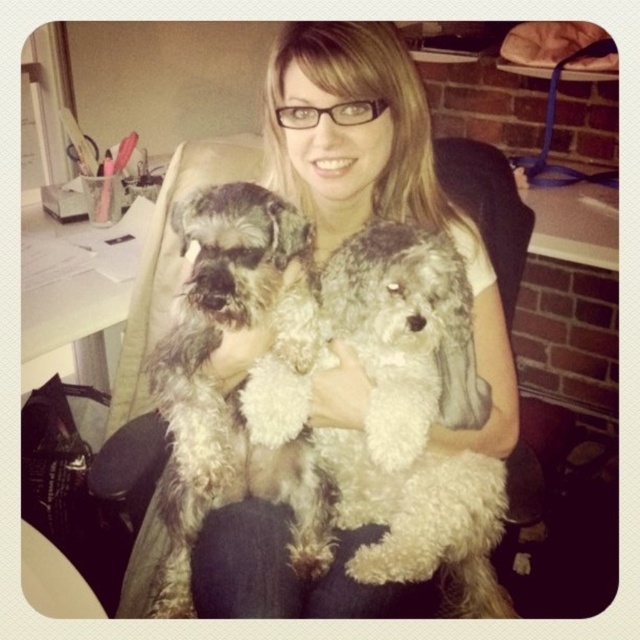
Question: Does smooth blonde hair at center come behind fuzzy gray dog at center?

Choices:
 (A) no
 (B) yes

Answer: (B)

Question: Which object is positioned farthest from the fuzzy gray dog at center?

Choices:
 (A) smooth blonde hair at center
 (B) fuzzy white dog at center

Answer: (B)

Question: Which point appears closest to the camera in this image?

Choices:
 (A) (262, 253)
 (B) (452, 246)

Answer: (A)

Question: Can you confirm if smooth blonde hair at center is wider than fuzzy white dog at center?

Choices:
 (A) no
 (B) yes

Answer: (B)

Question: Does fuzzy white dog at center have a lesser width compared to fuzzy gray dog at center?

Choices:
 (A) yes
 (B) no

Answer: (B)

Question: Among these points, which one is farthest from the camera?

Choices:
 (A) (490, 609)
 (B) (291, 220)

Answer: (A)